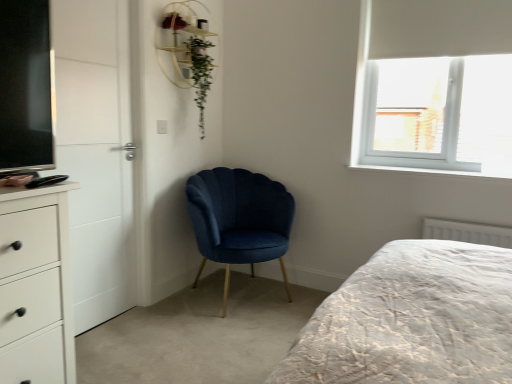
In order to face white plastic window at upper right, should I rotate leftwards or rightwards?

Turn right approximately 22.900 degrees to face it.

This screenshot has width=512, height=384. Identify the location of white matte chest of drawers at left. (36, 286).

Find the location of a particular element. The height and width of the screenshot is (384, 512). velvet blue chair at center is located at coordinates (239, 219).

Locate an element on the screen. white plastic window at upper right is located at coordinates (362, 100).

Is white textured radiator at lower right at the left side of white matte chest of drawers at left?

Incorrect, white textured radiator at lower right is not on the left side of white matte chest of drawers at left.

Between white textured radiator at lower right and white matte chest of drawers at left, which one has smaller size?

With smaller size is white textured radiator at lower right.

Which of these two, white textured radiator at lower right or white matte chest of drawers at left, stands taller?

Standing taller between the two is white matte chest of drawers at left.

Is white textured radiator at lower right far away from white plastic window at upper right?

white textured radiator at lower right is actually quite close to white plastic window at upper right.

Is white textured radiator at lower right looking in the opposite direction of white plastic window at upper right?

No, white textured radiator at lower right is not facing the opposite direction of white plastic window at upper right.

Is point (447, 235) less distant than point (382, 169)?

Yes, point (447, 235) is closer to viewer.

Can we say white textured radiator at lower right lies outside white plastic window at upper right?

Yes, white textured radiator at lower right is located beyond the bounds of white plastic window at upper right.

Does white textured radiator at lower right touch velvet blue chair at center?

white textured radiator at lower right and velvet blue chair at center are not in contact.

How many degrees apart are the facing directions of white textured radiator at lower right and velvet blue chair at center?

There is a 68.3-degree angle between the facing directions of white textured radiator at lower right and velvet blue chair at center.

From a real-world perspective, is white textured radiator at lower right physically below velvet blue chair at center?

No, from a real-world perspective, white textured radiator at lower right is not below velvet blue chair at center.

Is wooden shelf at upper center turned away from white matte chest of drawers at left?

No, white matte chest of drawers at left is not at the back of wooden shelf at upper center.

Is wooden shelf at upper center outside of white matte chest of drawers at left?

Yes, wooden shelf at upper center is located beyond the bounds of white matte chest of drawers at left.

Measure the distance between wooden shelf at upper center and white matte chest of drawers at left.

wooden shelf at upper center is 1.56 meters from white matte chest of drawers at left.

Which object is wider, wooden shelf at upper center or white matte chest of drawers at left?

white matte chest of drawers at left.

Is wooden shelf at upper center in front of or behind velvet blue chair at center in the image?

wooden shelf at upper center is behind velvet blue chair at center.

Can you confirm if wooden shelf at upper center is positioned to the right of velvet blue chair at center?

No.

In the scene shown: What's the angular difference between wooden shelf at upper center and velvet blue chair at center's facing directions?

The angular difference between wooden shelf at upper center and velvet blue chair at center is 21.8 degrees.

Considering the sizes of objects wooden shelf at upper center and velvet blue chair at center in the image provided, who is taller, wooden shelf at upper center or velvet blue chair at center?

velvet blue chair at center is taller.

Considering the positions of objects green leafy plant at upper center and white matte chest of drawers at left in the image provided, who is in front, green leafy plant at upper center or white matte chest of drawers at left?

white matte chest of drawers at left is more forward.

Is green leafy plant at upper center to the right of white matte chest of drawers at left from the viewer's perspective?

Indeed, green leafy plant at upper center is positioned on the right side of white matte chest of drawers at left.

From a real-world perspective, is green leafy plant at upper center physically located above or below white matte chest of drawers at left?

Clearly, from a real-world perspective, green leafy plant at upper center is above white matte chest of drawers at left.

Can you confirm if green leafy plant at upper center is wider than white matte chest of drawers at left?

No.

In the scene shown: Can you confirm if white matte chest of drawers at left is wider than wooden shelf at upper center?

Yes, white matte chest of drawers at left is wider than wooden shelf at upper center.

Identify the location of chest of drawers on the left of wooden shelf at upper center. (36, 286).

Can wooden shelf at upper center be found inside white matte chest of drawers at left?

No, white matte chest of drawers at left does not contain wooden shelf at upper center.

Considering the relative sizes of white matte chest of drawers at left and wooden shelf at upper center in the image provided, is white matte chest of drawers at left smaller than wooden shelf at upper center?

Incorrect, white matte chest of drawers at left is not smaller in size than wooden shelf at upper center.

Locate an element on the screen. chest of drawers below the white textured radiator at lower right (from the image's perspective) is located at coordinates (36, 286).

This screenshot has width=512, height=384. I want to click on radiator on the right of white plastic window at upper right, so click(x=467, y=232).

Estimate the real-world distances between objects in this image. Which object is further from white textured radiator at lower right, white plastic window at upper right or wooden shelf at upper center?

wooden shelf at upper center is positioned further to the anchor white textured radiator at lower right.

Considering their positions, is green leafy plant at upper center positioned further to wooden shelf at upper center than white textured radiator at lower right?

white textured radiator at lower right is further to wooden shelf at upper center.

Which object lies further to the anchor point velvet blue chair at center, white plastic window at upper right or white matte chest of drawers at left?

Among the two, white matte chest of drawers at left is located further to velvet blue chair at center.

From the image, which object appears to be farther from white matte chest of drawers at left, white plastic window at upper right or white textured radiator at lower right?

white textured radiator at lower right is positioned further to the anchor white matte chest of drawers at left.

When comparing their distances from velvet blue chair at center, does white plastic window at upper right or white textured radiator at lower right seem further?

white textured radiator at lower right is positioned further to the anchor velvet blue chair at center.

Looking at the image, which one is located closer to white plastic window at upper right, white matte chest of drawers at left or white textured radiator at lower right?

Among the two, white textured radiator at lower right is located nearer to white plastic window at upper right.

From the image, which object appears to be nearer to wooden shelf at upper center, white plastic window at upper right or white textured radiator at lower right?

white plastic window at upper right lies closer to wooden shelf at upper center than the other object.

Estimate the real-world distances between objects in this image. Which object is closer to velvet blue chair at center, white matte chest of drawers at left or wooden shelf at upper center?

wooden shelf at upper center is closer to velvet blue chair at center.

Locate an element on the screen. The width and height of the screenshot is (512, 384). shelf between white matte chest of drawers at left and white plastic window at upper right from left to right is located at coordinates (180, 41).

Locate an element on the screen. window between white matte chest of drawers at left and white textured radiator at lower right in the horizontal direction is located at coordinates (362, 100).

Where is `window between green leafy plant at upper center and white textured radiator at lower right from left to right`? This screenshot has width=512, height=384. window between green leafy plant at upper center and white textured radiator at lower right from left to right is located at coordinates (362, 100).

Find the location of a particular element. This screenshot has height=384, width=512. window situated between velvet blue chair at center and white textured radiator at lower right from left to right is located at coordinates (362, 100).